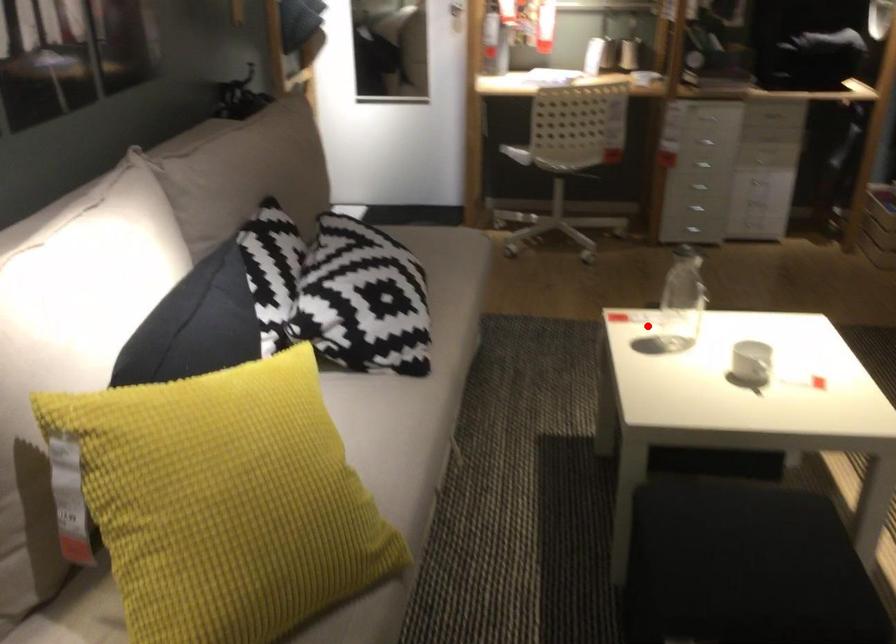
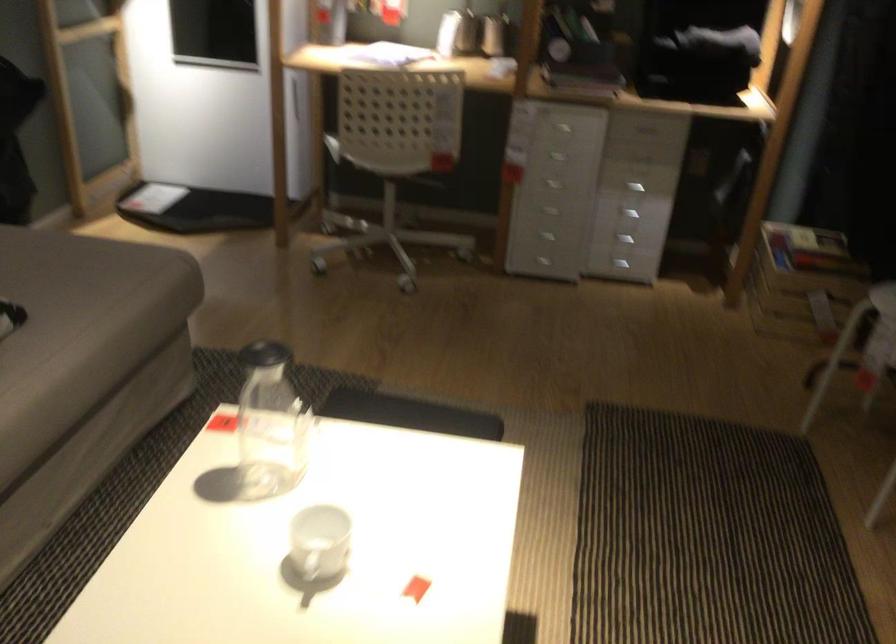
The point at the highlighted location is marked in the first image. Where is the corresponding point in the second image?

(270, 424)